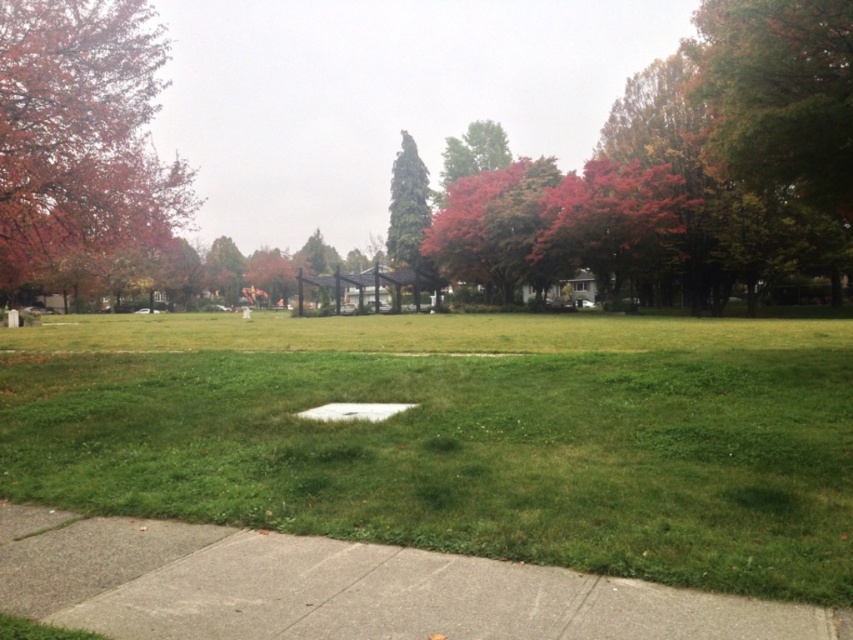
Looking at this image, you are a gardener who needs to place a 2.5 meter wide decorative stone path in the park. The gray concrete sidewalk at lower left is currently narrower than the shiny red leaves at upper right. Which area should you choose to install the path without exceeding the width of the existing feature?

You should install the decorative stone path at the shiny red leaves at upper right because the gray concrete sidewalk at lower left is narrower than the shiny red leaves at upper right, so the upper right area has enough width to accommodate the 2.5 meter wide path.